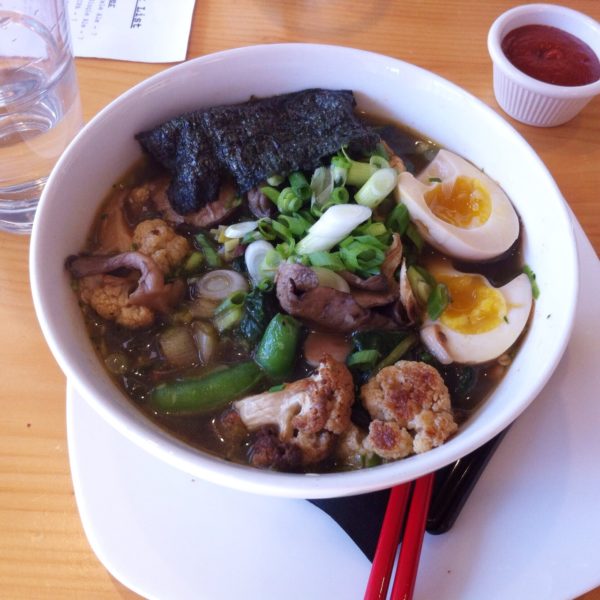
In order to click on plate in this screenshot , I will do `click(547, 501)`.